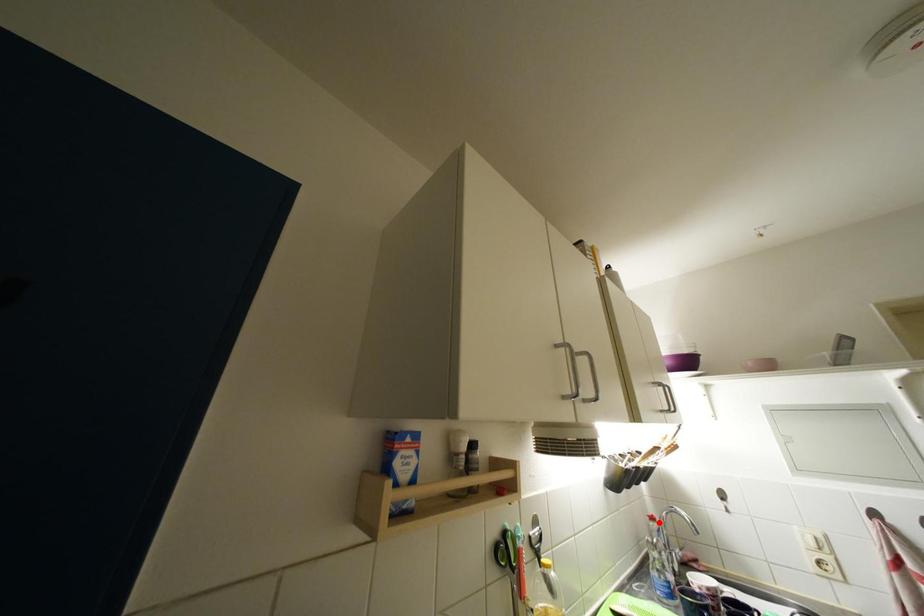
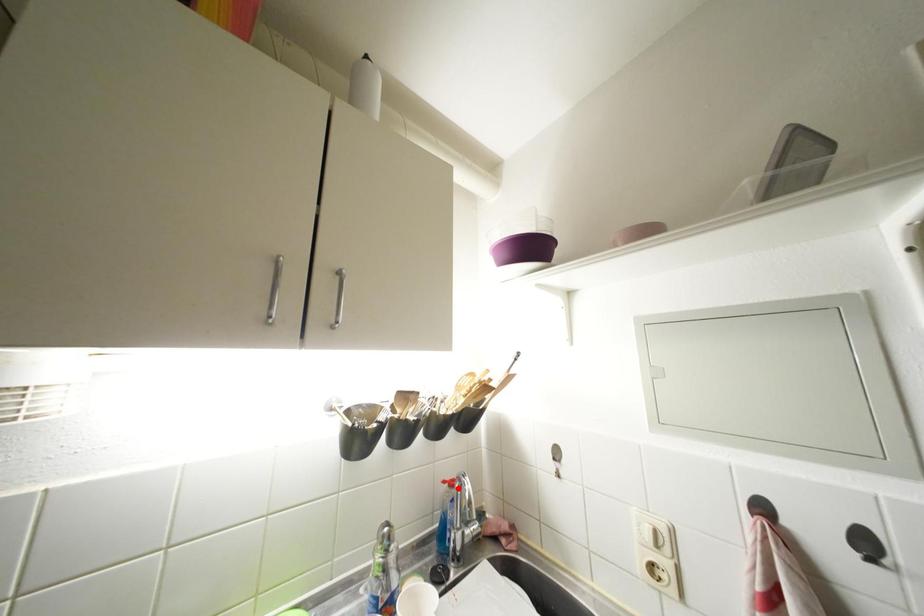
I am providing you with two images of the same scene from different viewpoints. A red point is marked on the first image and another point is marked on the second image. Is the red point in image1 aligned with the point shown in image2?

Yes